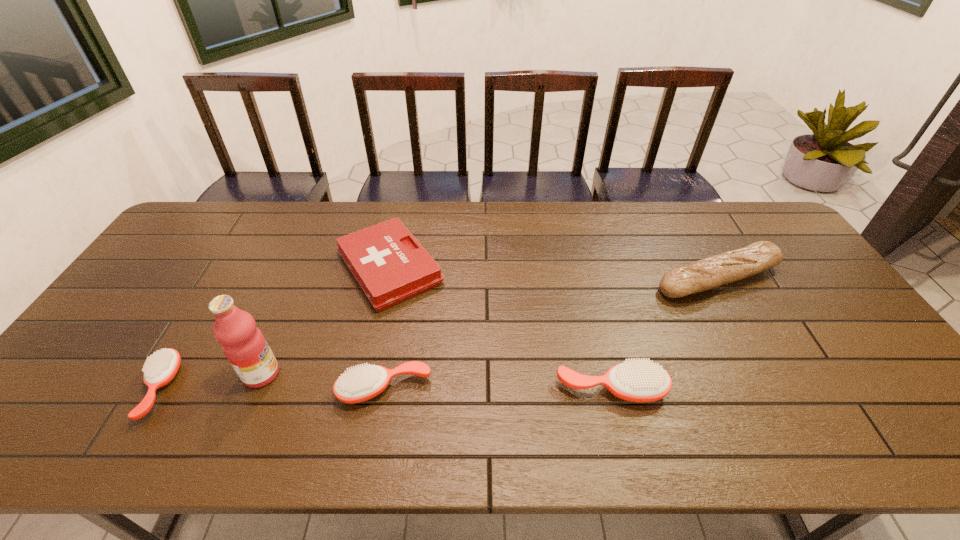
The width and height of the screenshot is (960, 540). I want to click on vacant place for an extra hairbrush on the right, so click(838, 390).